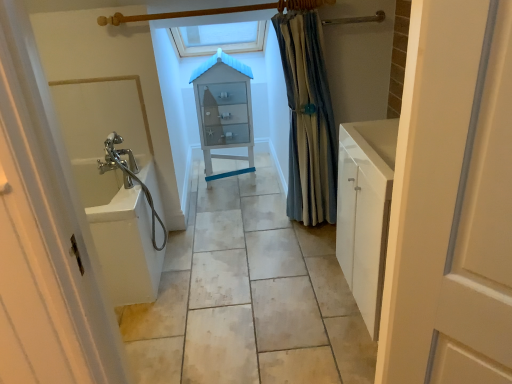
At what (x,y) coordinates should I click in order to perform the action: click on blank space above white glossy sink at left (from a real-world perspective). Please return your answer as a coordinate pair (x, y). Looking at the image, I should click on (236, 253).